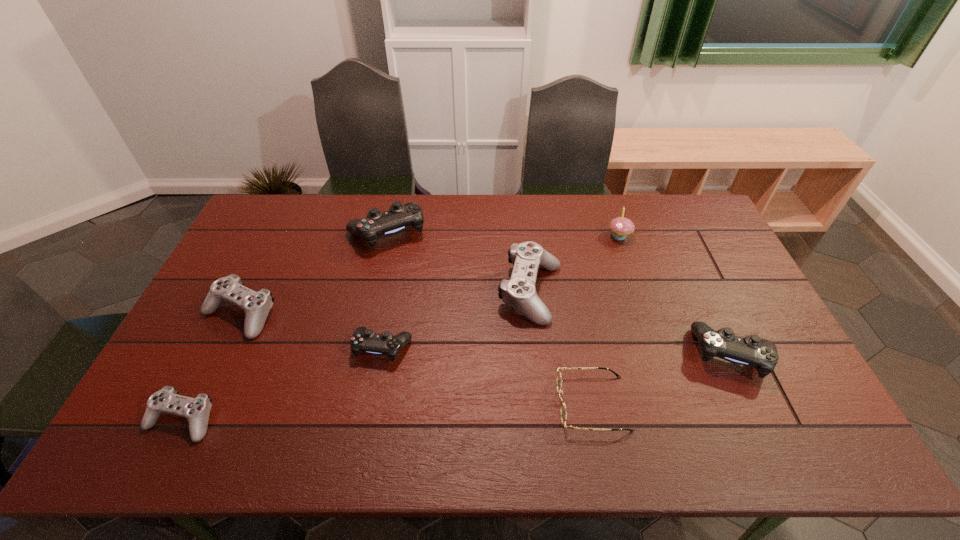
In order to click on free region at the near edge of the desktop in this screenshot , I will do `click(581, 448)`.

Where is `free space at the left edge of the desktop`? This screenshot has width=960, height=540. free space at the left edge of the desktop is located at coordinates (191, 377).

Find the location of a particular element. The height and width of the screenshot is (540, 960). vacant point at the right edge is located at coordinates (698, 283).

Locate an element on the screen. This screenshot has height=540, width=960. vacant space at the far left corner of the desktop is located at coordinates (257, 218).

Where is `free location at the far right corner`? Image resolution: width=960 pixels, height=540 pixels. free location at the far right corner is located at coordinates (688, 215).

Locate an element on the screen. vacant area that lies between the biggest black control and the shortest control is located at coordinates (284, 326).

The width and height of the screenshot is (960, 540). In order to click on blank region between the second biggest black control and the green spectacles in this screenshot , I will do `click(662, 379)`.

Image resolution: width=960 pixels, height=540 pixels. I want to click on free space between the farthest control and the second smallest white control, so click(x=313, y=273).

Where is `unoccupied position between the smallest black control and the green spectacles`? The height and width of the screenshot is (540, 960). unoccupied position between the smallest black control and the green spectacles is located at coordinates (488, 375).

Image resolution: width=960 pixels, height=540 pixels. In order to click on free area in between the shortest control and the smallest black control in this screenshot , I will do `click(282, 383)`.